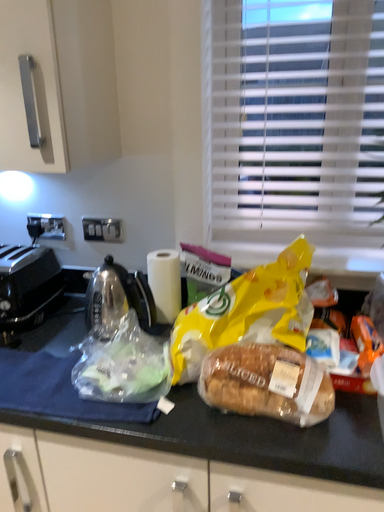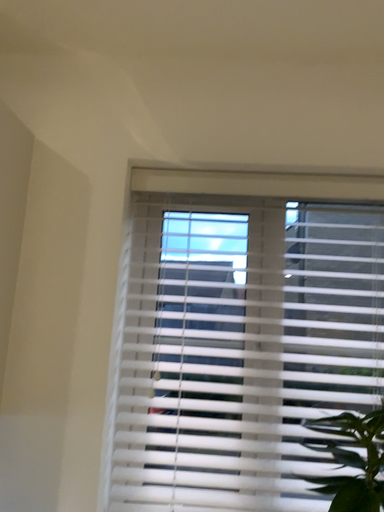
Question: Which way did the camera rotate in the video?

Choices:
 (A) rotated left
 (B) rotated right

Answer: (B)